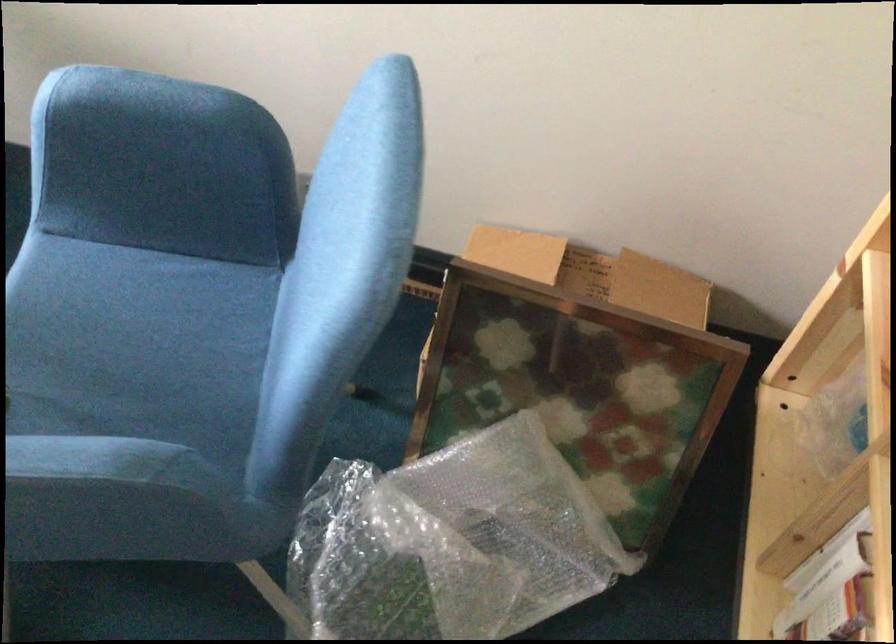
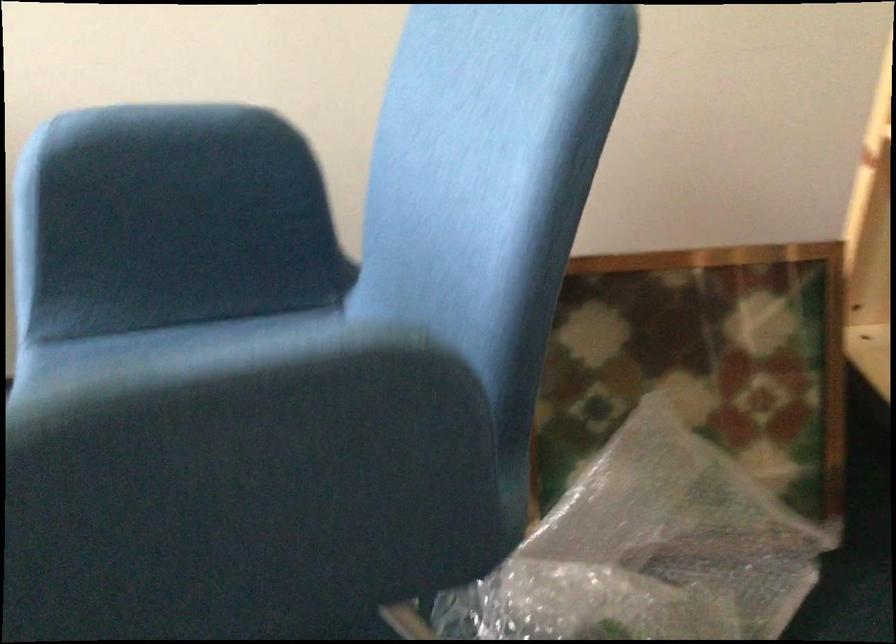
Find the pixel in the second image that matches point (151, 109) in the first image.

(159, 142)